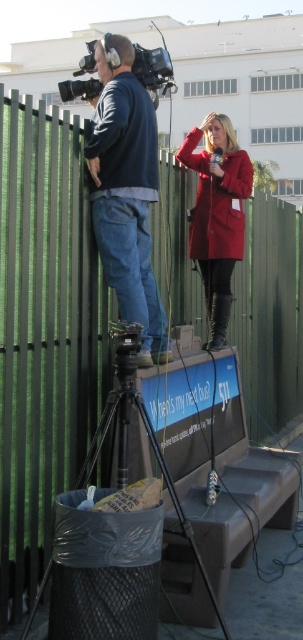
Question: Among these points, which one is nearest to the camera?

Choices:
 (A) (146, 566)
 (B) (162, 84)
 (C) (196, 138)
 (D) (103, 204)

Answer: (A)

Question: Is black plastic tripod at lower center above matte red coat at center?

Choices:
 (A) yes
 (B) no

Answer: (B)

Question: Where is black plastic tripod at lower center located in relation to matte black video camera at upper left in the image?

Choices:
 (A) left
 (B) right

Answer: (B)

Question: Is black plastic tripod at lower center below blue denim jeans at center?

Choices:
 (A) no
 (B) yes

Answer: (B)

Question: Which object is closer to the camera taking this photo?

Choices:
 (A) black plastic tripod at lower center
 (B) blue denim jeans at center
 (C) matte black video camera at upper left
 (D) matte red coat at center

Answer: (A)

Question: Which object is the closest to the matte black video camera at upper left?

Choices:
 (A) black plastic tripod at lower center
 (B) matte red coat at center
 (C) blue denim jeans at center

Answer: (C)